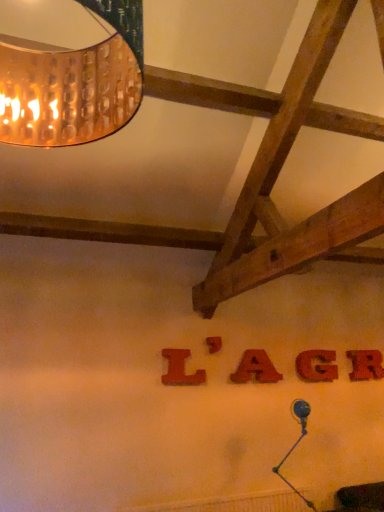
Question: In which direction should I rotate to look at red felt letter a at center, which ranks as the third letter in left-to-right order?

Choices:
 (A) right
 (B) left

Answer: (A)

Question: Is red matte letter g at center, marked as the 2th letter in a right-to-left arrangement, closer to camera compared to red wood letter at center, the fifth letter viewed from the left?

Choices:
 (A) yes
 (B) no

Answer: (A)

Question: Considering the relative sizes of red matte letter g at center, the 4th letter when ordered from left to right, and red wood letter at center, placed as the 1th letter when sorted from right to left, in the image provided, is red matte letter g at center, the 4th letter when ordered from left to right, thinner than red wood letter at center, placed as the 1th letter when sorted from right to left,?

Choices:
 (A) yes
 (B) no

Answer: (B)

Question: Is red matte letter g at center, marked as the 2th letter in a right-to-left arrangement, not inside red wood letter at center, the fifth letter viewed from the left?

Choices:
 (A) yes
 (B) no

Answer: (A)

Question: Does red matte letter g at center, the 4th letter when ordered from left to right, have a smaller size compared to red wood letter at center, placed as the 1th letter when sorted from right to left?

Choices:
 (A) no
 (B) yes

Answer: (B)

Question: From a real-world perspective, does red matte letter g at center, the 4th letter when ordered from left to right, sit lower than red wood letter at center, the fifth letter viewed from the left?

Choices:
 (A) yes
 (B) no

Answer: (A)

Question: From a real-world perspective, does red matte letter g at center, the 4th letter when ordered from left to right, stand above red wood letter at center, the fifth letter viewed from the left?

Choices:
 (A) no
 (B) yes

Answer: (A)

Question: Can you confirm if red wood letter at center, the fifth letter viewed from the left, is positioned to the left of copper textured lampshade at upper left?

Choices:
 (A) no
 (B) yes

Answer: (A)

Question: Is red wood letter at center, the fifth letter viewed from the left, not inside copper textured lampshade at upper left?

Choices:
 (A) yes
 (B) no

Answer: (A)

Question: Is there a large distance between red wood letter at center, placed as the 1th letter when sorted from right to left, and copper textured lampshade at upper left?

Choices:
 (A) yes
 (B) no

Answer: (A)

Question: Is red wood letter at center, the fifth letter viewed from the left, bigger than copper textured lampshade at upper left?

Choices:
 (A) no
 (B) yes

Answer: (A)

Question: Does red wood letter at center, the fifth letter viewed from the left, have a smaller size compared to copper textured lampshade at upper left?

Choices:
 (A) yes
 (B) no

Answer: (A)

Question: Is red wood letter at center, the fifth letter viewed from the left, turned away from copper textured lampshade at upper left?

Choices:
 (A) no
 (B) yes

Answer: (A)

Question: From the image's perspective, is red matte letter g at center, marked as the 2th letter in a right-to-left arrangement, over red felt letter a at center, which ranks as the third letter in left-to-right order?

Choices:
 (A) yes
 (B) no

Answer: (B)